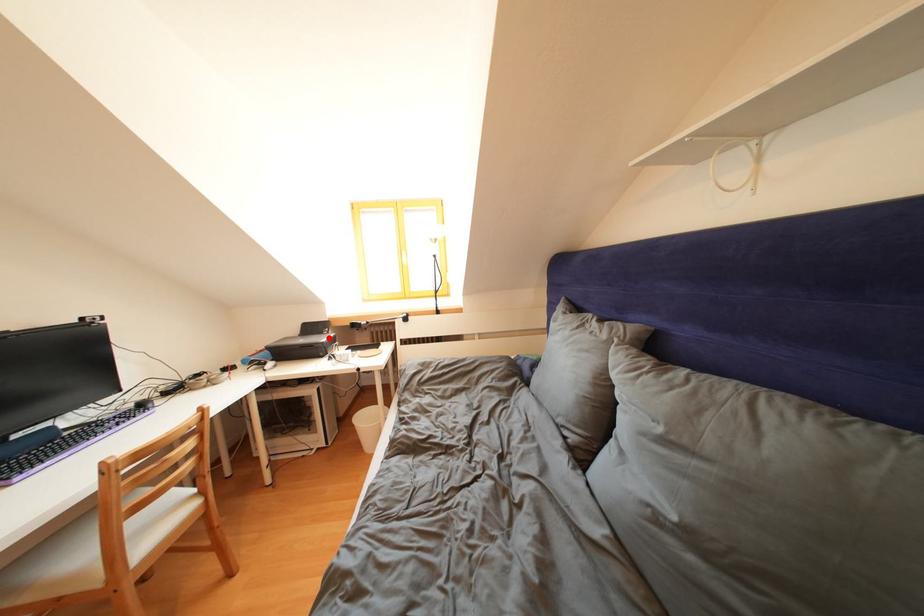
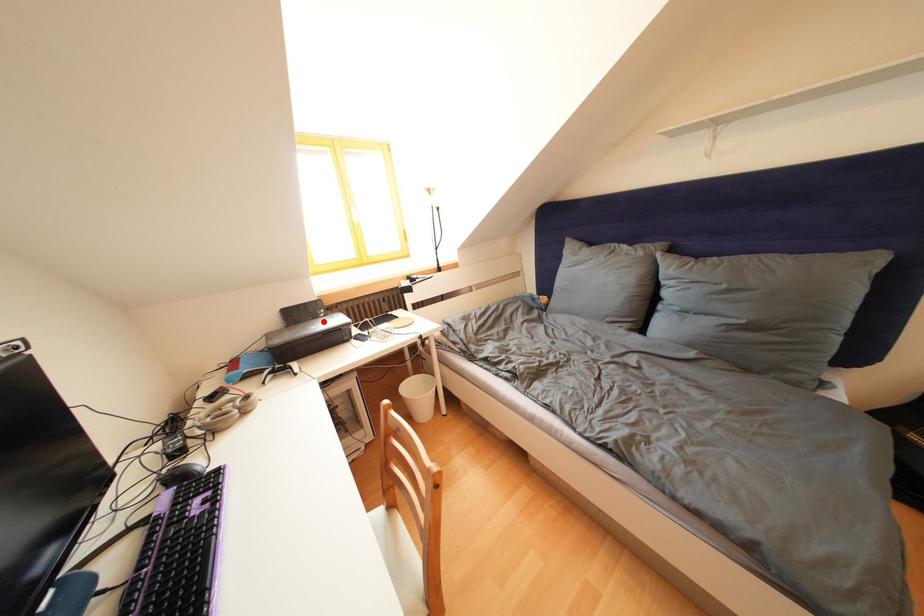
I am providing you with two images of the same scene from different viewpoints. A red point is marked on the first image and another point is marked on the second image. Does the point marked in image1 correspond to the same location as the one in image2?

Yes